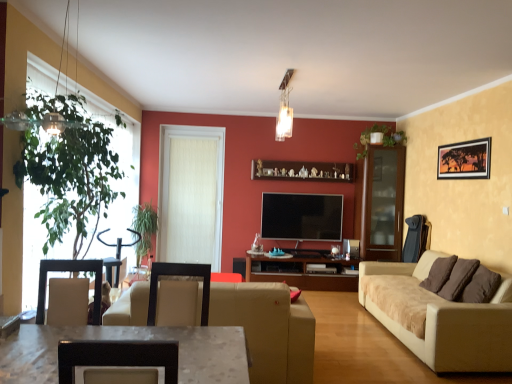
Question: Does metallic glass light fixture at upper center have a smaller size compared to beige suede sofa at right, placed as the first studio couch when sorted from right to left?

Choices:
 (A) yes
 (B) no

Answer: (A)

Question: Considering the relative sizes of metallic glass light fixture at upper center and beige suede sofa at right, the 2th studio couch from the left, in the image provided, is metallic glass light fixture at upper center wider than beige suede sofa at right, the 2th studio couch from the left,?

Choices:
 (A) yes
 (B) no

Answer: (B)

Question: Is metallic glass light fixture at upper center positioned before beige suede sofa at right, placed as the first studio couch when sorted from right to left?

Choices:
 (A) yes
 (B) no

Answer: (B)

Question: Is metallic glass light fixture at upper center oriented away from beige suede sofa at right, placed as the first studio couch when sorted from right to left?

Choices:
 (A) yes
 (B) no

Answer: (B)

Question: Is metallic glass light fixture at upper center outside of beige suede sofa at right, the 2th studio couch from the left?

Choices:
 (A) yes
 (B) no

Answer: (A)

Question: Does metallic glass light fixture at upper center have a larger size compared to beige suede sofa at right, the 2th studio couch from the left?

Choices:
 (A) no
 (B) yes

Answer: (A)

Question: Is green leafy plant at upper center, arranged as the 1th plant when viewed from the top, beside transparent glass cabinet at right?

Choices:
 (A) no
 (B) yes

Answer: (A)

Question: Considering the relative sizes of green leafy plant at upper center, positioned as the first plant in right-to-left order, and transparent glass cabinet at right in the image provided, is green leafy plant at upper center, positioned as the first plant in right-to-left order, bigger than transparent glass cabinet at right?

Choices:
 (A) no
 (B) yes

Answer: (A)

Question: Is green leafy plant at upper center, positioned as the first plant in right-to-left order, surrounding transparent glass cabinet at right?

Choices:
 (A) yes
 (B) no

Answer: (B)

Question: Is green leafy plant at upper center, positioned as the first plant in right-to-left order, completely or partially outside of transparent glass cabinet at right?

Choices:
 (A) no
 (B) yes

Answer: (B)

Question: Is green leafy plant at upper center, arranged as the 1th plant when viewed from the top, wider than transparent glass cabinet at right?

Choices:
 (A) yes
 (B) no

Answer: (B)

Question: Is green leafy plant at upper center, positioned as the first plant in right-to-left order, at the right side of transparent glass cabinet at right?

Choices:
 (A) yes
 (B) no

Answer: (B)

Question: Does beige suede sofa at right, the 2th studio couch from the left, have a greater height compared to green leafy plant at upper center, arranged as the 1th plant when viewed from the top?

Choices:
 (A) no
 (B) yes

Answer: (B)